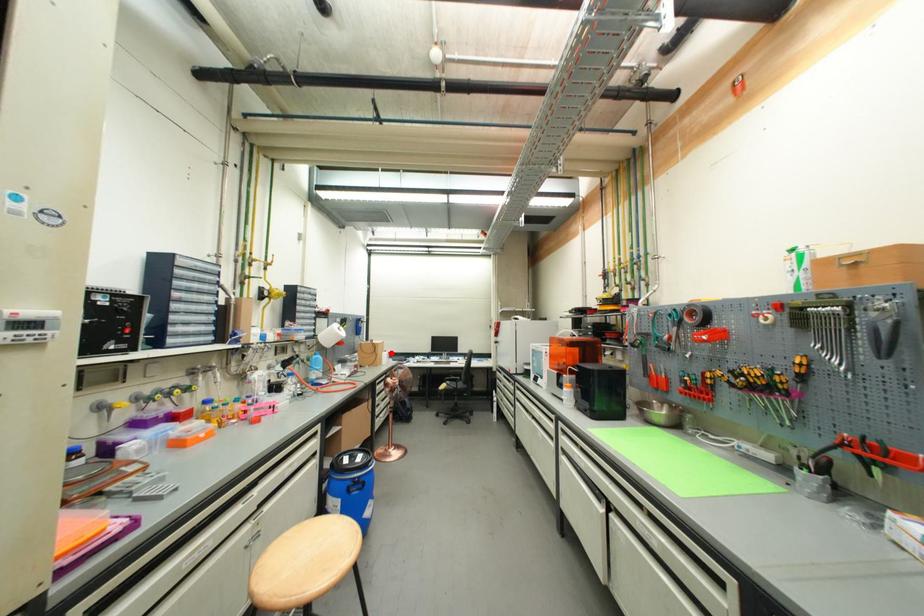
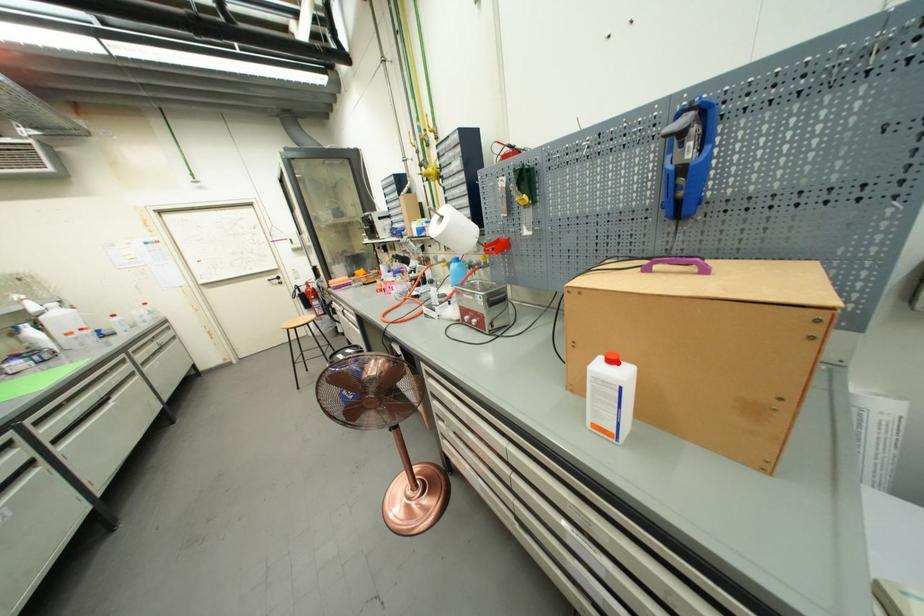
I am providing you with two images of the same scene from different viewpoints. A red point is marked on the first image and another point is marked on the second image. Do the highlighted points in image1 and image2 indicate the same real-world spot?

Yes